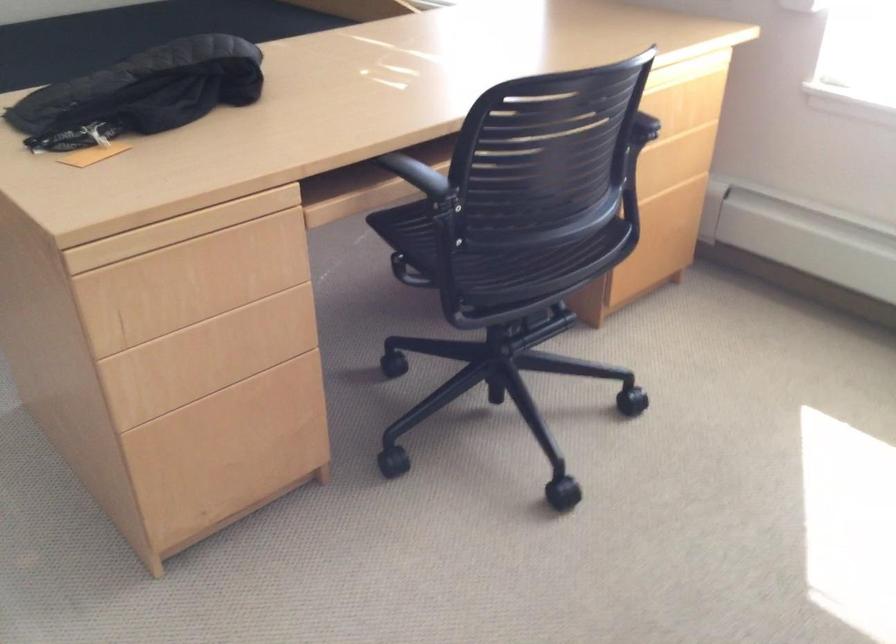
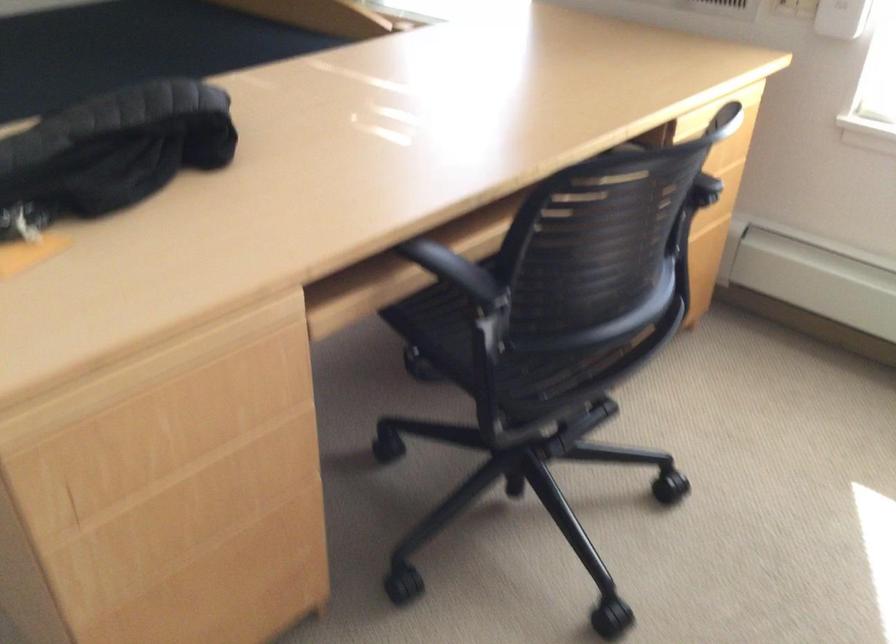
Which direction would the cameraman need to move to produce the second image?

The cameraman moved toward left, forward.